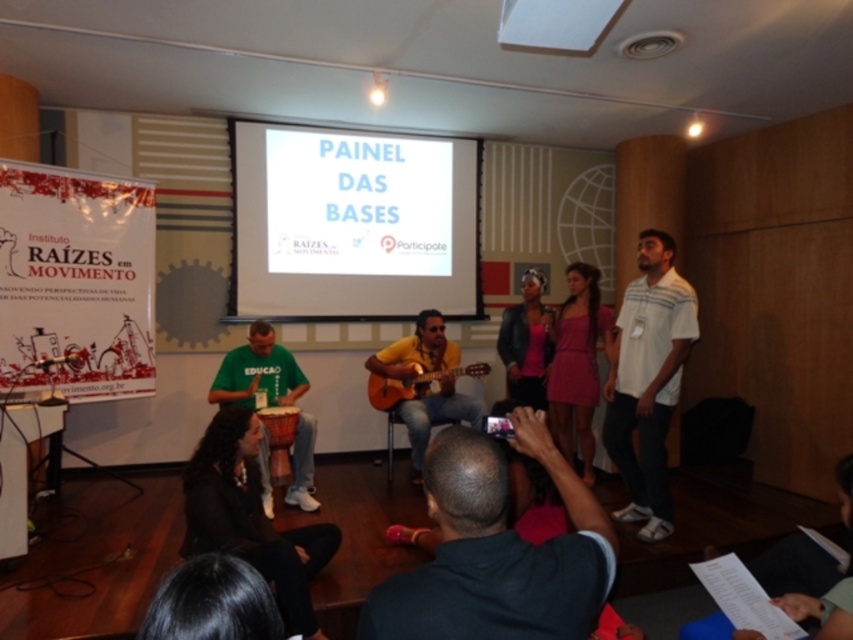
You are attending a presentation and need to move from the entrance to the refreshments area located near the banner on the left. There is a black leather jacket at lower left and a pink satin dress at center in your way. Can you walk around them safely?

The black leather jacket at lower left is to the left of the pink satin dress at center. Since both objects are positioned along the path, you should move around them carefully, possibly taking a detour to the right of the pink satin dress at center to reach the refreshments area safely.

You are an attendee at the event and want to take a photo of the white matte projection screen at upper center without the green fabric shirt at center appearing in the frame. Which direction should you move to achieve this?

The white matte projection screen at upper center is to the right of the green fabric shirt at center. To avoid the green fabric shirt at center in your photo, move to the left side of the room so that the screen is framed without the shirt obstructing the view.